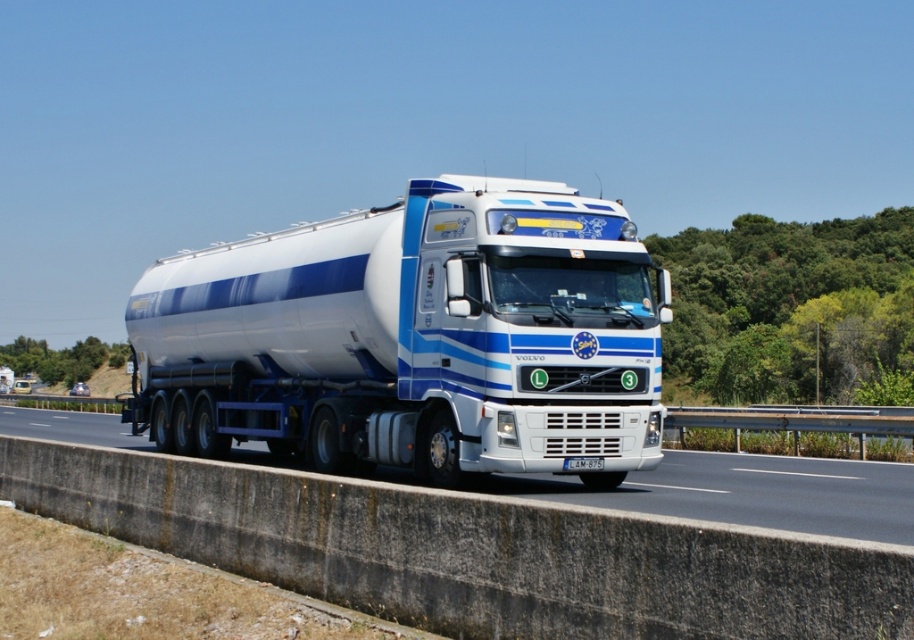
Question: Can you confirm if white glossy tanker at center is thinner than white concrete barrier at lower center?

Choices:
 (A) yes
 (B) no

Answer: (A)

Question: Can you confirm if white glossy tanker at center is wider than white concrete barrier at lower center?

Choices:
 (A) no
 (B) yes

Answer: (A)

Question: Which point is farther to the camera?

Choices:
 (A) (911, 468)
 (B) (644, 394)

Answer: (A)

Question: Among these points, which one is farthest from the camera?

Choices:
 (A) pos(312,394)
 (B) pos(699,465)

Answer: (B)

Question: Which point appears closest to the camera in this image?

Choices:
 (A) (62, 440)
 (B) (167, 324)

Answer: (B)

Question: Can you confirm if white glossy tanker at center is thinner than white concrete barrier at lower center?

Choices:
 (A) no
 (B) yes

Answer: (B)